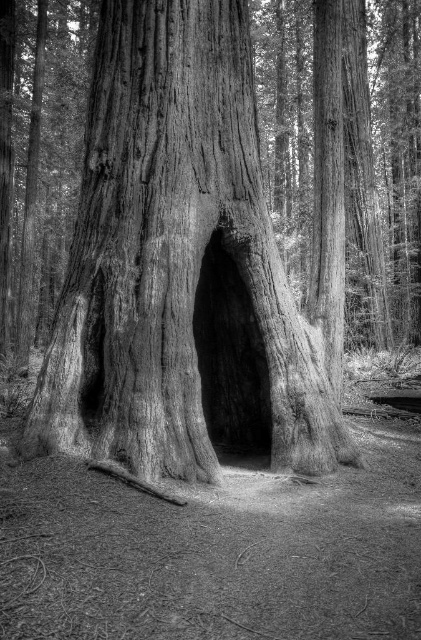
Does point (93, 317) lie behind point (199, 326)?

No.

Is grainy wood tree trunk at center taller than smooth wood hole at center?

Yes.

Is point (271, 461) closer to camera compared to point (237, 378)?

Yes.

Image resolution: width=421 pixels, height=640 pixels. I want to click on grainy wood tree trunk at center, so click(x=178, y=268).